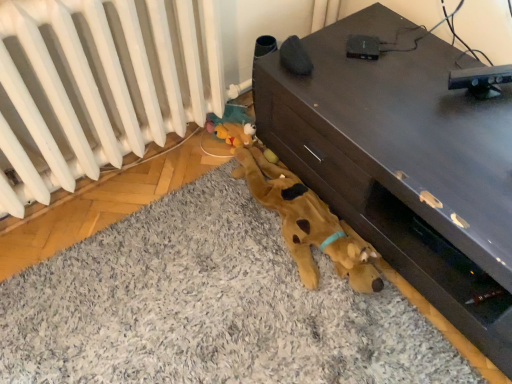
Image resolution: width=512 pixels, height=384 pixels. I want to click on soft gray carpet at lower center, so click(208, 307).

You are a GUI agent. You are given a task and a screenshot of the screen. Output one action in this format:
    pyautogui.click(x=<x>, y=<y>)
    Task: Click on the brown matte tv stand at lower right
    This screenshot has width=512, height=384.
    Given the screenshot: What is the action you would take?
    pyautogui.click(x=404, y=164)

Considering the relative positions of white matte radiator at lower left and brown matte tv stand at lower right in the image provided, is white matte radiator at lower left to the right of brown matte tv stand at lower right from the viewer's perspective?

No.

Is white matte radiator at lower left not near brown matte tv stand at lower right?

white matte radiator at lower left is actually quite close to brown matte tv stand at lower right.

From a real-world perspective, does white matte radiator at lower left stand above brown matte tv stand at lower right?

Indeed, from a real-world perspective, white matte radiator at lower left stands above brown matte tv stand at lower right.

How much distance is there between white matte radiator at lower left and brown matte tv stand at lower right?

They are 57.47 centimeters apart.

Are soft gray carpet at lower center and brown matte tv stand at lower right far apart?

No.

Between soft gray carpet at lower center and brown matte tv stand at lower right, which one has more height?

brown matte tv stand at lower right is taller.

Does soft gray carpet at lower center turn towards brown matte tv stand at lower right?

No, soft gray carpet at lower center is not oriented towards brown matte tv stand at lower right.

From a real-world perspective, relative to brown matte tv stand at lower right, is soft gray carpet at lower center vertically above or below?

soft gray carpet at lower center is situated lower than brown matte tv stand at lower right in the real world.

Looking at this image, from the image's perspective, is white matte radiator at lower left over soft gray carpet at lower center?

Yes, from the image's perspective, white matte radiator at lower left is on top of soft gray carpet at lower center.

The width and height of the screenshot is (512, 384). Identify the location of mat below the white matte radiator at lower left (from a real-world perspective). (208, 307).

Considering the sizes of objects white matte radiator at lower left and soft gray carpet at lower center in the image provided, who is shorter, white matte radiator at lower left or soft gray carpet at lower center?

Standing shorter between the two is soft gray carpet at lower center.

Visually, is white matte radiator at lower left positioned to the left or to the right of soft gray carpet at lower center?

From the image, it's evident that white matte radiator at lower left is to the left of soft gray carpet at lower center.

The height and width of the screenshot is (384, 512). Find the location of `mat on the right of white matte radiator at lower left`. mat on the right of white matte radiator at lower left is located at coordinates (208, 307).

Considering the sizes of objects soft gray carpet at lower center and white matte radiator at lower left in the image provided, who is wider, soft gray carpet at lower center or white matte radiator at lower left?

soft gray carpet at lower center.

Looking at this image, is soft gray carpet at lower center oriented towards white matte radiator at lower left?

No, soft gray carpet at lower center does not turn towards white matte radiator at lower left.

Choose the correct answer: Is brown matte tv stand at lower right inside white matte radiator at lower left or outside it?

brown matte tv stand at lower right is not enclosed by white matte radiator at lower left.

Based on their sizes in the image, would you say brown matte tv stand at lower right is bigger or smaller than white matte radiator at lower left?

In the image, brown matte tv stand at lower right appears to be larger than white matte radiator at lower left.

From the picture: Is brown matte tv stand at lower right not near white matte radiator at lower left?

brown matte tv stand at lower right is actually quite close to white matte radiator at lower left.

Can you confirm if brown matte tv stand at lower right is positioned to the left of white matte radiator at lower left?

No, brown matte tv stand at lower right is not to the left of white matte radiator at lower left.

Which is behind, point (420, 214) or point (195, 343)?

The point (195, 343) is more distant.

From a real-world perspective, which object rests below the other?

soft gray carpet at lower center is physically lower.

From the image's perspective, which one is positioned lower, brown matte tv stand at lower right or soft gray carpet at lower center?

soft gray carpet at lower center, from the image's perspective.

This screenshot has height=384, width=512. I want to click on radiator to the left of brown matte tv stand at lower right, so click(97, 86).

Image resolution: width=512 pixels, height=384 pixels. Find the location of `furniture above the soft gray carpet at lower center (from a real-world perspective)`. furniture above the soft gray carpet at lower center (from a real-world perspective) is located at coordinates (404, 164).

Estimate the real-world distances between objects in this image. Which object is closer to soft gray carpet at lower center, white matte radiator at lower left or brown matte tv stand at lower right?

brown matte tv stand at lower right is closer to soft gray carpet at lower center.

Looking at the image, which one is located closer to brown matte tv stand at lower right, soft gray carpet at lower center or white matte radiator at lower left?

Among the two, soft gray carpet at lower center is located nearer to brown matte tv stand at lower right.

Looking at the image, which one is located further to brown matte tv stand at lower right, white matte radiator at lower left or soft gray carpet at lower center?

white matte radiator at lower left.

Estimate the real-world distances between objects in this image. Which object is further from white matte radiator at lower left, brown matte tv stand at lower right or soft gray carpet at lower center?

Based on the image, brown matte tv stand at lower right appears to be further to white matte radiator at lower left.

Based on their spatial positions, is soft gray carpet at lower center or brown matte tv stand at lower right further from white matte radiator at lower left?

brown matte tv stand at lower right.

Based on their spatial positions, is brown matte tv stand at lower right or white matte radiator at lower left closer to soft gray carpet at lower center?

brown matte tv stand at lower right is positioned closer to the anchor soft gray carpet at lower center.

The width and height of the screenshot is (512, 384). I want to click on mat situated between white matte radiator at lower left and brown matte tv stand at lower right from left to right, so click(208, 307).